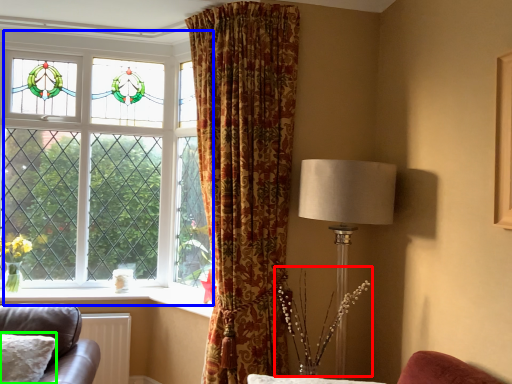
Question: Considering the real-world distances, which object is farthest from floral arrangement (highlighted by a red box)? window (highlighted by a blue box) or pillow (highlighted by a green box)?

Choices:
 (A) window
 (B) pillow

Answer: (A)